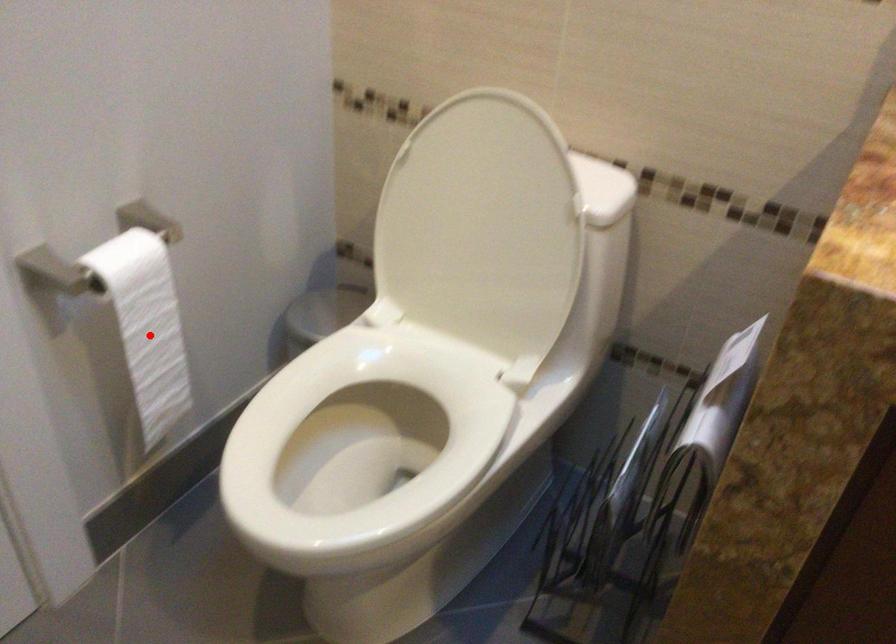
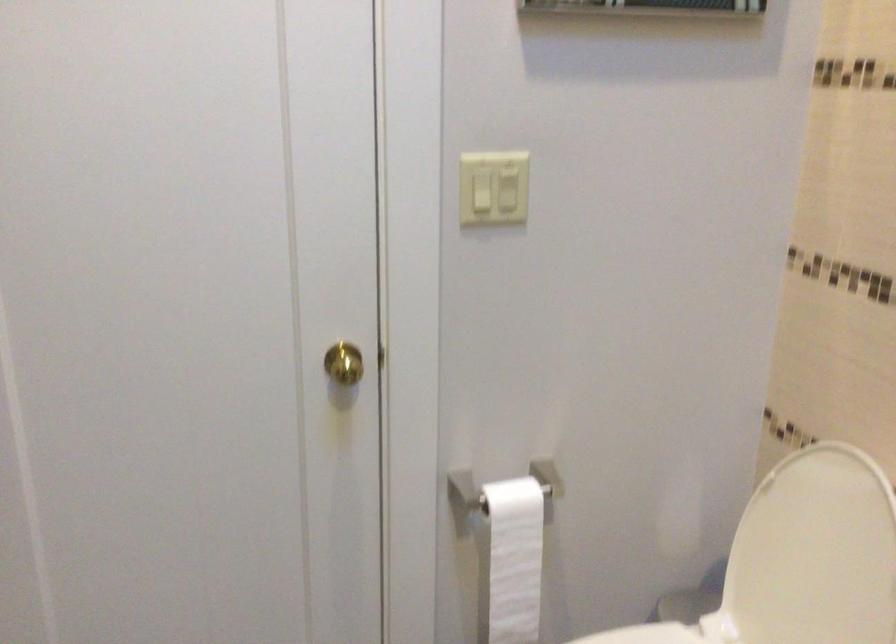
Question: I am providing you with two images of the same scene from different viewpoints. Image1 has a red point marked. In image2, the corresponding 3D location appears at what relative position? Reply with the corresponding letter.

Choices:
 (A) Closer
 (B) Farther

Answer: (B)